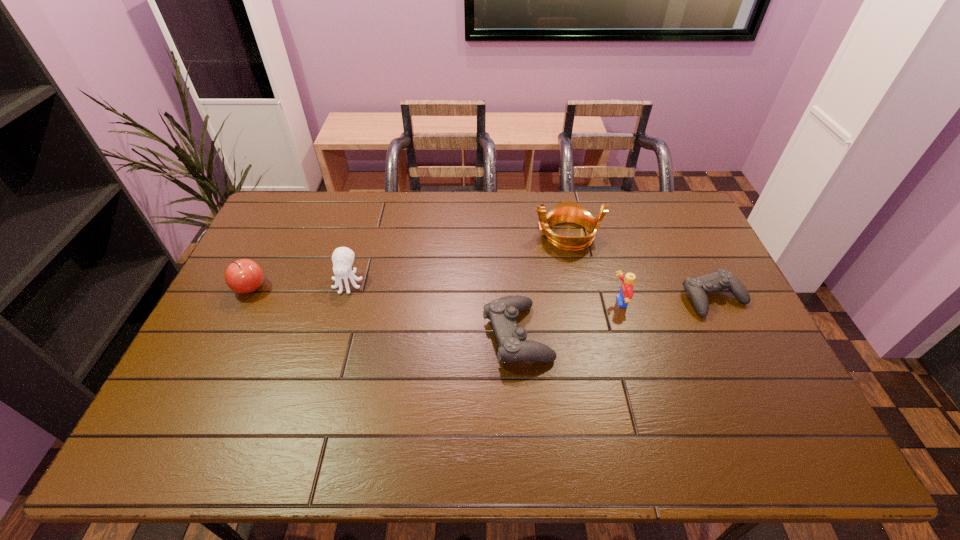
You are a GUI agent. You are given a task and a screenshot of the screen. Output one action in this format:
    pyautogui.click(x=<x>, y=<y>)
    Task: Click on the blank region between the apple and the tiara
    
    Given the screenshot: What is the action you would take?
    pyautogui.click(x=409, y=261)

Identify the location of vacant space that's between the leftmost object and the Lego. (435, 295).

At what (x,y) coordinates should I click in order to perform the action: click on empty space that is in between the second shortest object and the shortest object. Please return your answer as a coordinate pair (x, y). This screenshot has width=960, height=540. Looking at the image, I should click on (615, 316).

Locate an element on the screen. The width and height of the screenshot is (960, 540). vacant point located between the octopus and the leftmost object is located at coordinates (300, 285).

Find the location of a particular element. The height and width of the screenshot is (540, 960). the third closest object to the farthest object is located at coordinates (698, 287).

Locate an element on the screen. The height and width of the screenshot is (540, 960). object that stands as the closest to the apple is located at coordinates pos(343,257).

The height and width of the screenshot is (540, 960). What are the coordinates of `vacant area in the image that satisfies the following two spatial constraints: 1. at the front emblem of the farthest object; 2. on the back side of the right control` in the screenshot? It's located at (581, 298).

Image resolution: width=960 pixels, height=540 pixels. I want to click on blank area in the image that satisfies the following two spatial constraints: 1. on the front-facing side of the second object from left to right; 2. on the right side of the shortest object, so click(344, 298).

The height and width of the screenshot is (540, 960). Find the location of `free spot that satisfies the following two spatial constraints: 1. at the front emblem of the rightmost object; 2. on the left side of the tiara`. free spot that satisfies the following two spatial constraints: 1. at the front emblem of the rightmost object; 2. on the left side of the tiara is located at coordinates (581, 298).

This screenshot has width=960, height=540. Identify the location of free spot that satisfies the following two spatial constraints: 1. on the front-facing side of the fifth object from right to left; 2. on the left side of the shorter control. (344, 298).